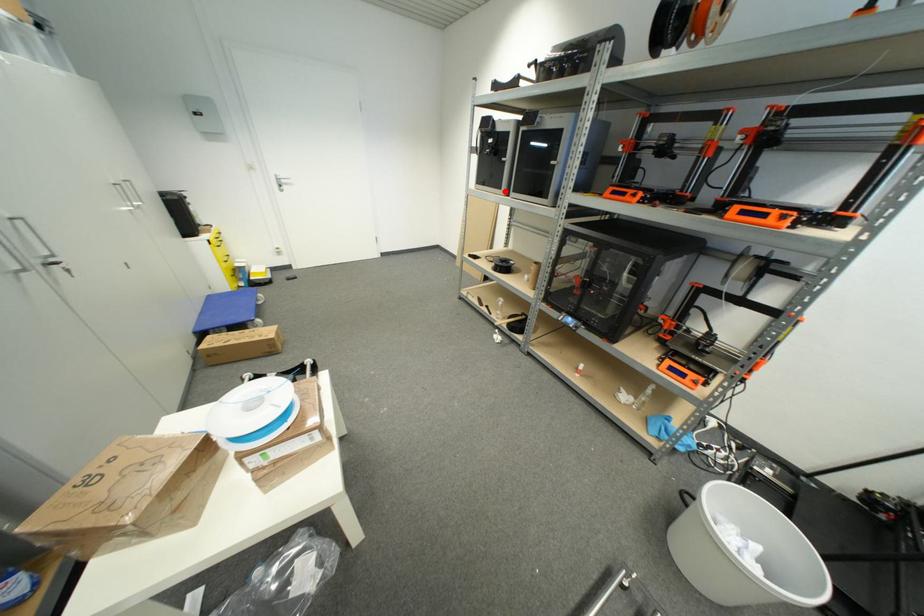
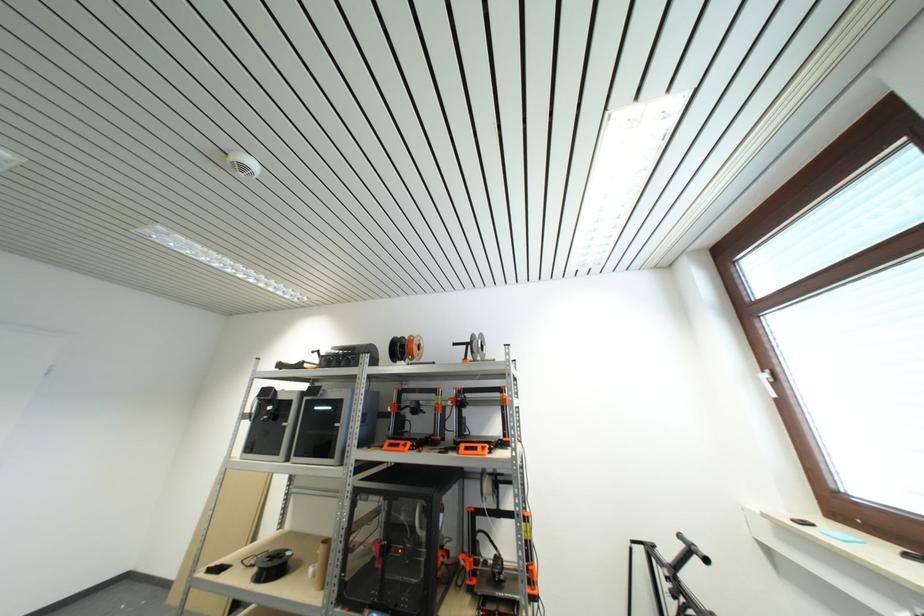
Find the pixel in the second image that matches the highlighted location in the first image.

(283, 456)